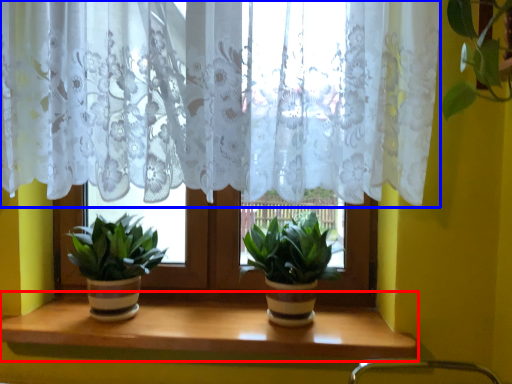
Question: Which object is further to the camera taking this photo, window sill (highlighted by a red box) or curtain (highlighted by a blue box)?

Choices:
 (A) window sill
 (B) curtain

Answer: (A)